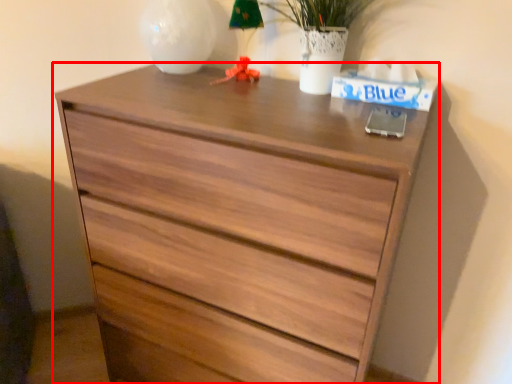
Question: In this image, where is chest of drawers (annotated by the red box) located relative to table lamp?

Choices:
 (A) right
 (B) left

Answer: (A)